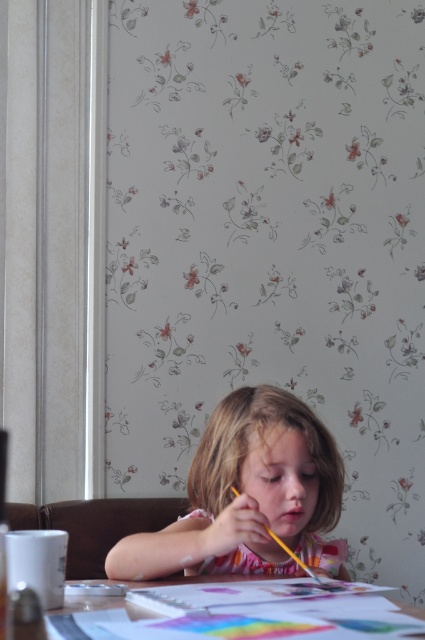
You are a parent observing your child painting at the table. You notice the smooth pink dress at center and the yellow matte crayon at center. Which object is taller?

The smooth pink dress at center is taller than the yellow matte crayon at center.

You are a photographer standing 1.5 meters away from the smooth pink dress at center. Can you reach the dress without moving your feet?

The smooth pink dress at center is 1.16 meters away from the camera, so yes, you can reach it without moving your feet since you are only 1.5 meters away.

You are a painter standing in front of the table where the child is painting. You notice two points marked on the wall behind the table. The first point is at coordinates point (231, 557) and the second point is at point (215, 580). Which point is closer to you?

Point (231, 557) is closer to you because it is further to the viewer than point (215, 580).